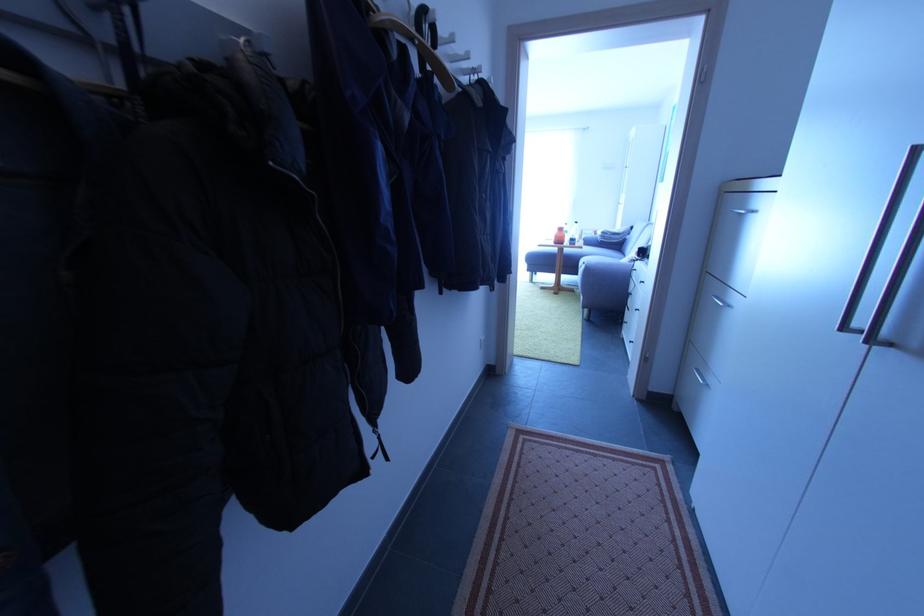
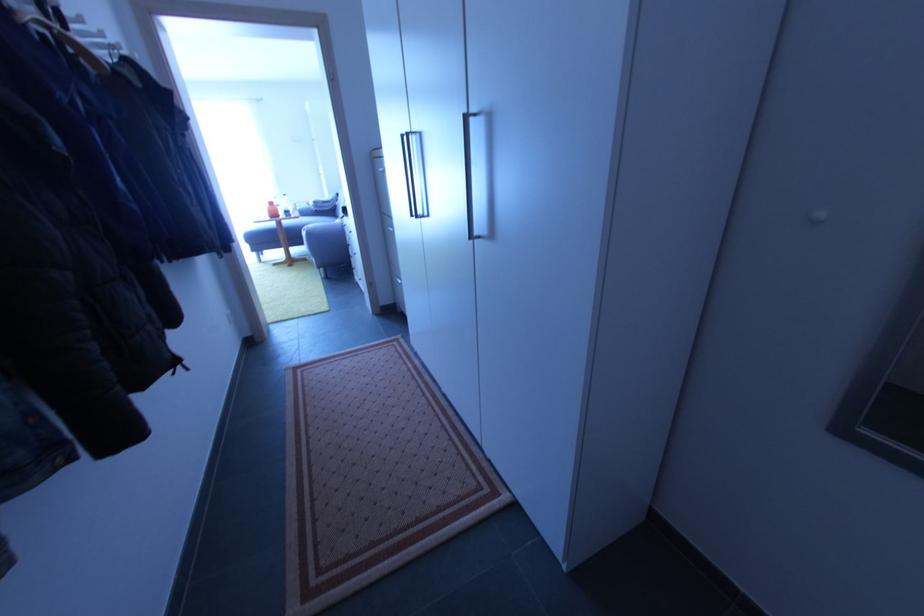
The point at (565, 232) is marked in the first image. Where is the corresponding point in the second image?

(275, 205)